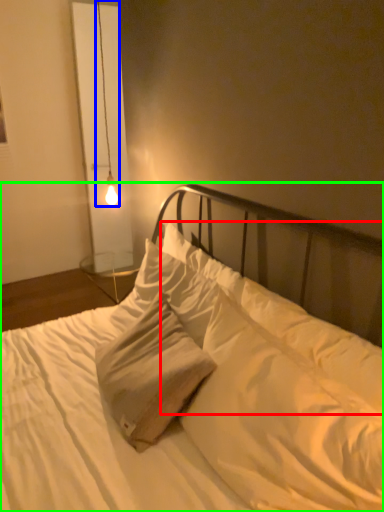
Question: Based on their relative distances, which object is farther from pillow (highlighted by a red box)? Choose from lamp (highlighted by a blue box) and bed (highlighted by a green box).

Choices:
 (A) lamp
 (B) bed

Answer: (A)